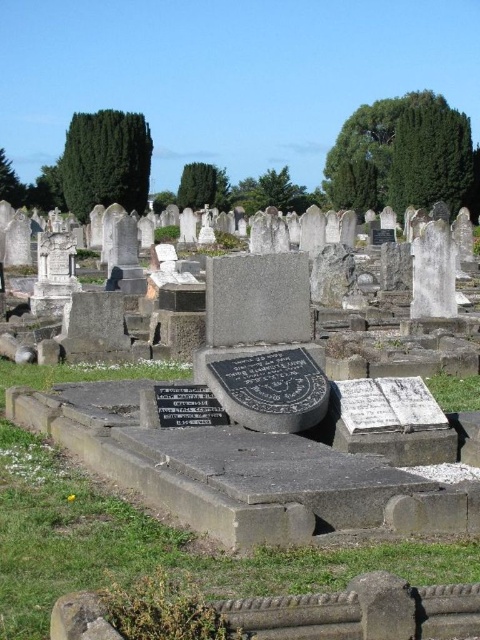
You are standing at the entrance of the cemetery and want to locate the granite gravestone at center. According to the coordinates provided, which direction should you walk to reach it?

The granite gravestone at center is located at coordinates point (240, 472). Since the coordinate system typically has (0, 0) at the bottom left corner, you should walk towards the right and slightly upwards from the entrance to reach it.

You are standing in the cemetery looking at the gravestones. There are two points marked in the scene, one at coordinates point (216, 468) and another at point (176, 404). Which point is closer to you?

Point (216, 468) is closer to the camera than point (176, 404).